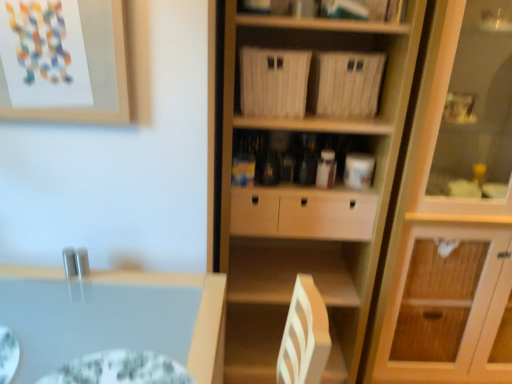
Question: Does green textured glass plate at lower left come in front of matte paper picture frame at upper left?

Choices:
 (A) yes
 (B) no

Answer: (A)

Question: Is green textured glass plate at lower left not within matte paper picture frame at upper left?

Choices:
 (A) yes
 (B) no

Answer: (A)

Question: Is green textured glass plate at lower left next to matte paper picture frame at upper left?

Choices:
 (A) no
 (B) yes

Answer: (A)

Question: Is green textured glass plate at lower left bigger than matte paper picture frame at upper left?

Choices:
 (A) yes
 (B) no

Answer: (B)

Question: Does green textured glass plate at lower left have a lesser height compared to matte paper picture frame at upper left?

Choices:
 (A) yes
 (B) no

Answer: (A)

Question: Based on their sizes in the image, would you say light wood cabinet at right is bigger or smaller than wooden cupboard at center?

Choices:
 (A) big
 (B) small

Answer: (A)

Question: From a real-world perspective, is light wood cabinet at right positioned above or below wooden cupboard at center?

Choices:
 (A) above
 (B) below

Answer: (A)

Question: Based on their positions, is light wood cabinet at right located to the left or right of wooden cupboard at center?

Choices:
 (A) left
 (B) right

Answer: (B)

Question: In terms of height, does light wood cabinet at right look taller or shorter compared to wooden cupboard at center?

Choices:
 (A) short
 (B) tall

Answer: (B)

Question: Is point (508, 114) closer or farther from the camera than point (108, 117)?

Choices:
 (A) farther
 (B) closer

Answer: (A)

Question: From a real-world perspective, is light wood cabinet at right positioned above or below matte paper picture frame at upper left?

Choices:
 (A) above
 (B) below

Answer: (B)

Question: In terms of height, does light wood cabinet at right look taller or shorter compared to matte paper picture frame at upper left?

Choices:
 (A) short
 (B) tall

Answer: (B)

Question: From the image's perspective, relative to matte paper picture frame at upper left, is light wood cabinet at right above or below?

Choices:
 (A) below
 (B) above

Answer: (A)

Question: Would you say green textured glass plate at lower left is inside or outside light wood cabinet at right?

Choices:
 (A) inside
 (B) outside

Answer: (B)

Question: Considering the positions of green textured glass plate at lower left and light wood cabinet at right in the image, is green textured glass plate at lower left wider or thinner than light wood cabinet at right?

Choices:
 (A) wide
 (B) thin

Answer: (B)